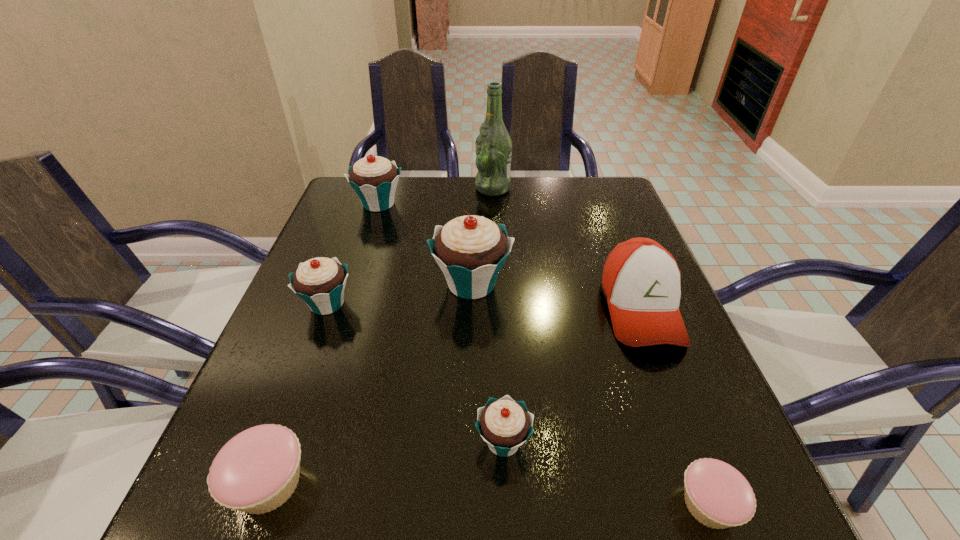
This screenshot has width=960, height=540. I want to click on free space located on the back of the second smallest teal cupcake, so click(x=356, y=226).

Where is `vacant region located on the left of the sixth tallest object`? The width and height of the screenshot is (960, 540). vacant region located on the left of the sixth tallest object is located at coordinates [x=252, y=442].

Find the location of a particular element. Image resolution: width=960 pixels, height=540 pixels. vacant space located 0.360m on the back of the second shortest cupcake is located at coordinates (338, 288).

Identify the location of free region located on the back of the smaller pink cupcake. The height and width of the screenshot is (540, 960). (641, 324).

Image resolution: width=960 pixels, height=540 pixels. What are the coordinates of `beer bottle located at the far edge` in the screenshot? It's located at (493, 145).

Locate an element on the screen. The height and width of the screenshot is (540, 960). cupcake that is positioned at the far edge is located at coordinates (374, 178).

In order to click on baseball cap that is at the right edge in this screenshot , I will do `click(641, 280)`.

Where is `cupcake at the right edge`? This screenshot has height=540, width=960. cupcake at the right edge is located at coordinates (718, 496).

Find the location of a particular element. This screenshot has height=540, width=960. object situated at the far left corner is located at coordinates (374, 178).

Image resolution: width=960 pixels, height=540 pixels. What are the coordinates of `object at the near left corner` in the screenshot? It's located at (256, 471).